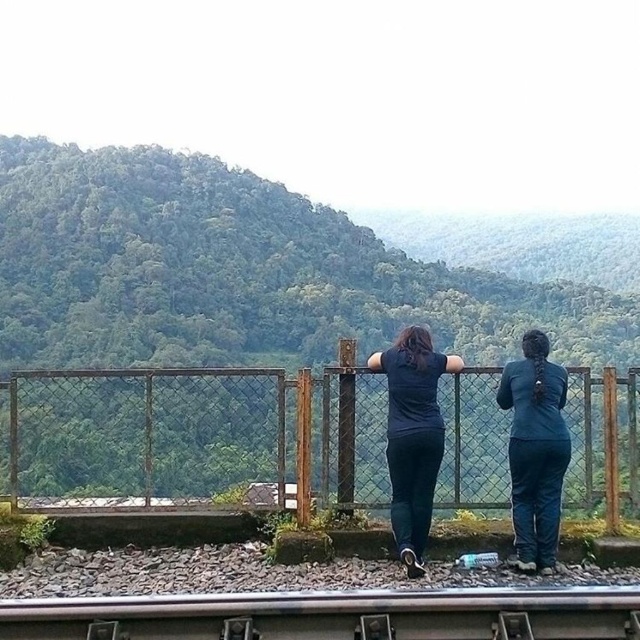
Is rusty metal fence at center smaller than teal fabric pants at right?

No, rusty metal fence at center is not smaller than teal fabric pants at right.

Which of these two, rusty metal fence at center or teal fabric pants at right, stands shorter?

rusty metal fence at center

Locate an element on the screen. The width and height of the screenshot is (640, 640). rusty metal fence at center is located at coordinates (145, 435).

Find the location of a particular element. rusty metal fence at center is located at coordinates (145, 435).

Between rusty metal fence at center and smooth metal train track at lower center, which one has more height?

With more height is rusty metal fence at center.

Is point (236, 404) positioned before point (612, 604)?

No, it is not.

Find the location of a particular element. Image resolution: width=640 pixels, height=640 pixels. rusty metal fence at center is located at coordinates (145, 435).

Who is higher up, green leafy forest at upper center or rusty metal fence at center?

green leafy forest at upper center is higher up.

Does point (161, 323) come behind point (577, 444)?

Yes, it is behind point (577, 444).

What do you see at coordinates (240, 272) in the screenshot? I see `green leafy forest at upper center` at bounding box center [240, 272].

Identify the location of green leafy forest at upper center. The height and width of the screenshot is (640, 640). (240, 272).